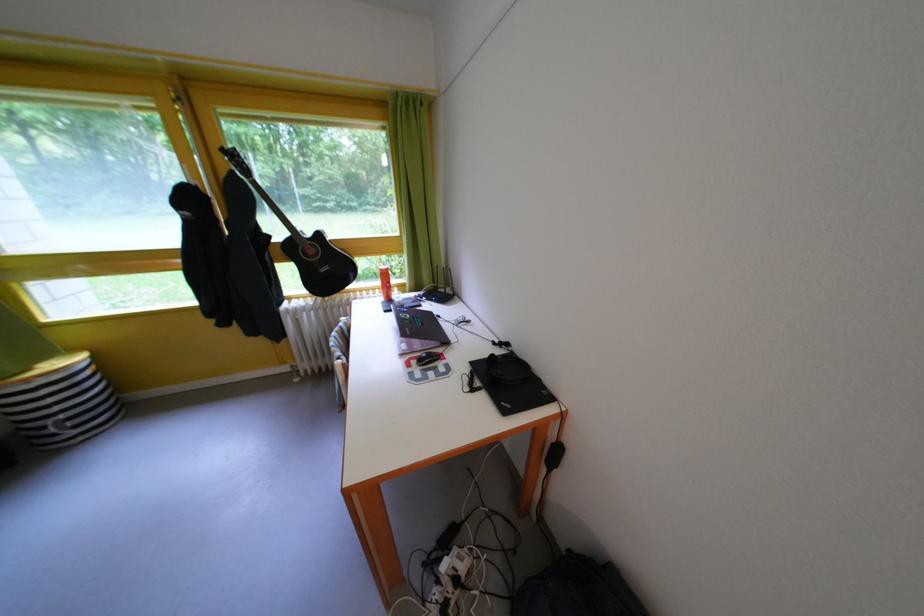
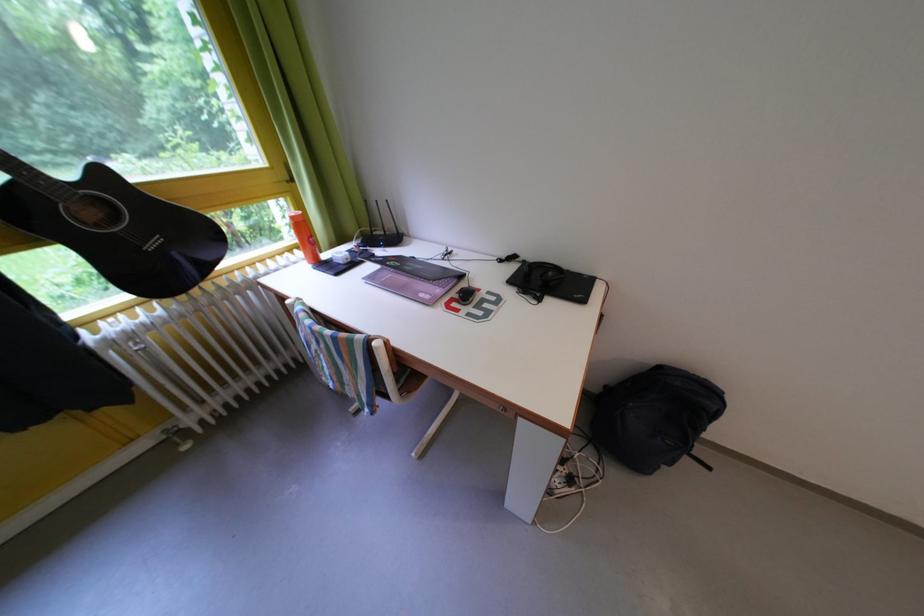
Where in the second image is the point corresponding to pixel 450 355 from the first image?

(473, 291)